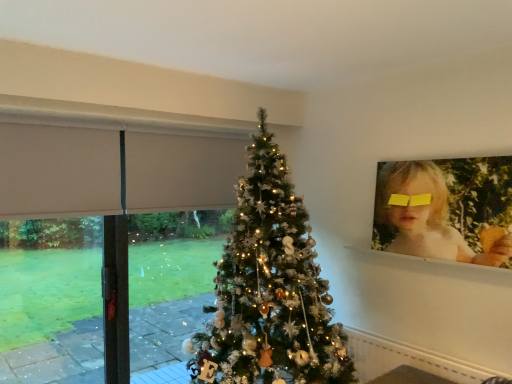
Question: From a real-world perspective, is blonde hair at upper right located beneath beige fabric at left?

Choices:
 (A) yes
 (B) no

Answer: (B)

Question: Is blonde hair at upper right taller than beige fabric at left?

Choices:
 (A) yes
 (B) no

Answer: (B)

Question: Does blonde hair at upper right have a larger size compared to beige fabric at left?

Choices:
 (A) yes
 (B) no

Answer: (B)

Question: Can you confirm if blonde hair at upper right is positioned to the right of beige fabric at left?

Choices:
 (A) no
 (B) yes

Answer: (B)

Question: Are blonde hair at upper right and beige fabric at left making contact?

Choices:
 (A) no
 (B) yes

Answer: (A)

Question: From a real-world perspective, is white glossy window sill at upper right positioned above or below blonde hair at upper right?

Choices:
 (A) above
 (B) below

Answer: (B)

Question: From the image's perspective, is white glossy window sill at upper right above or below blonde hair at upper right?

Choices:
 (A) above
 (B) below

Answer: (B)

Question: Relative to blonde hair at upper right, is white glossy window sill at upper right in front or behind?

Choices:
 (A) behind
 (B) front

Answer: (A)

Question: Visually, is white glossy window sill at upper right positioned to the left or to the right of blonde hair at upper right?

Choices:
 (A) right
 (B) left

Answer: (B)

Question: In the image, is white glittery christmas tree at center positioned in front of or behind blonde hair at upper right?

Choices:
 (A) behind
 (B) front

Answer: (B)

Question: Looking at the image, does white glittery christmas tree at center seem bigger or smaller compared to blonde hair at upper right?

Choices:
 (A) small
 (B) big

Answer: (B)

Question: Considering the positions of white glittery christmas tree at center and blonde hair at upper right in the image, is white glittery christmas tree at center taller or shorter than blonde hair at upper right?

Choices:
 (A) tall
 (B) short

Answer: (A)

Question: Do you think white glittery christmas tree at center is within blonde hair at upper right, or outside of it?

Choices:
 (A) inside
 (B) outside

Answer: (B)

Question: From the image's perspective, is beige fabric at left located above or below white glittery christmas tree at center?

Choices:
 (A) below
 (B) above

Answer: (A)

Question: Is beige fabric at left inside the boundaries of white glittery christmas tree at center, or outside?

Choices:
 (A) outside
 (B) inside

Answer: (A)